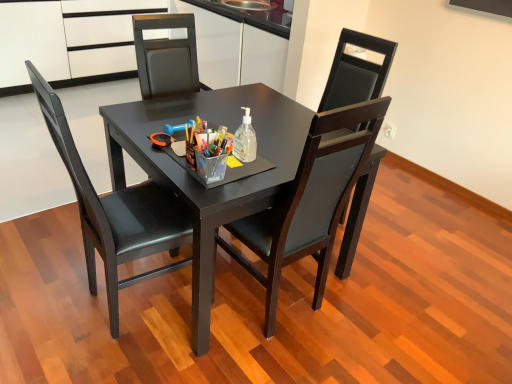
The width and height of the screenshot is (512, 384). What are the coordinates of `vacant space in front of clear plastic bottle at center` in the screenshot? It's located at (246, 171).